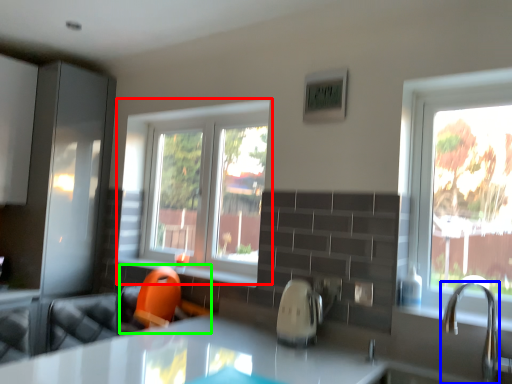
Question: Which object is the closest to the window (highlighted by a red box)? Choose among these: tap (highlighted by a blue box) or swivel chair (highlighted by a green box).

Choices:
 (A) tap
 (B) swivel chair

Answer: (B)